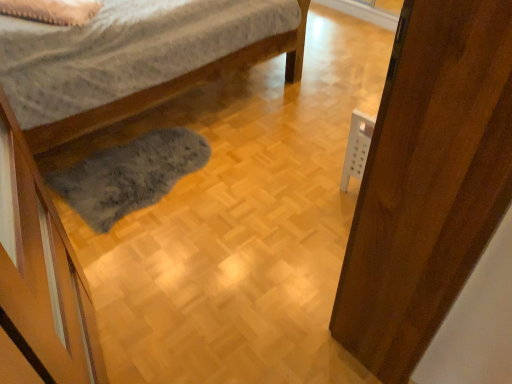
Question: Visually, is white soft pillow at upper left positioned to the left or to the right of wooden door at right?

Choices:
 (A) right
 (B) left

Answer: (B)

Question: Considering the positions of white soft pillow at upper left and wooden door at right in the image, is white soft pillow at upper left wider or thinner than wooden door at right?

Choices:
 (A) wide
 (B) thin

Answer: (A)

Question: From the image's perspective, is white soft pillow at upper left above or below wooden door at right?

Choices:
 (A) above
 (B) below

Answer: (A)

Question: From a real-world perspective, relative to white soft pillow at upper left, is wooden door at right vertically above or below?

Choices:
 (A) above
 (B) below

Answer: (B)

Question: Based on their positions, is wooden door at right located to the left or right of white soft pillow at upper left?

Choices:
 (A) right
 (B) left

Answer: (A)

Question: Which is correct: wooden door at right is inside white soft pillow at upper left, or outside of it?

Choices:
 (A) inside
 (B) outside

Answer: (B)

Question: From the image's perspective, is wooden door at right positioned above or below white soft pillow at upper left?

Choices:
 (A) below
 (B) above

Answer: (A)